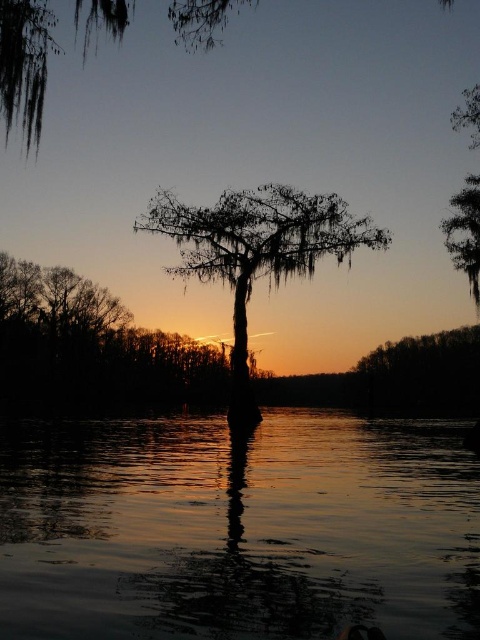
Question: Which object is farther from the camera taking this photo?

Choices:
 (A) silhouette mossy cypress tree at center
 (B) glossy reflective water at center
 (C) green mossy branch at upper left
 (D) silvery bark tree at upper right

Answer: (A)

Question: Can you confirm if silvery bark tree at center is positioned below silhouette mossy cypress tree at center?

Choices:
 (A) yes
 (B) no

Answer: (A)

Question: Which object is the farthest from the silvery bark tree at center?

Choices:
 (A) silvery bark tree at upper right
 (B) glossy reflective water at center
 (C) green mossy branch at upper left
 (D) silhouette mossy cypress tree at center

Answer: (B)

Question: Considering the relative positions of silhouette mossy cypress tree at center and green mossy branch at upper left in the image provided, where is silhouette mossy cypress tree at center located with respect to green mossy branch at upper left?

Choices:
 (A) left
 (B) right

Answer: (B)

Question: Can you confirm if glossy reflective water at center is positioned to the right of silvery bark tree at upper right?

Choices:
 (A) yes
 (B) no

Answer: (B)

Question: Which point is closer to the camera?

Choices:
 (A) (245, 234)
 (B) (314, 468)
 (C) (75, 336)

Answer: (B)